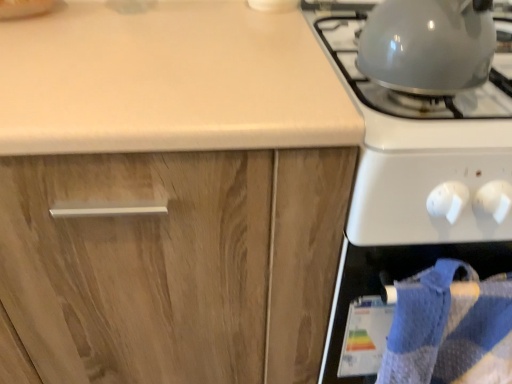
Question: Is blue textured towel at lower right placed right next to shiny metallic kettle at upper right, acting as the 2th gas stove starting from the right?

Choices:
 (A) no
 (B) yes

Answer: (A)

Question: Is blue textured towel at lower right surrounding shiny metallic kettle at upper right, which is the first gas stove in left-to-right order?

Choices:
 (A) yes
 (B) no

Answer: (B)

Question: Is blue textured towel at lower right wider than shiny metallic kettle at upper right, acting as the 2th gas stove starting from the right?

Choices:
 (A) yes
 (B) no

Answer: (B)

Question: From the image's perspective, is blue textured towel at lower right beneath shiny metallic kettle at upper right, which is the first gas stove in left-to-right order?

Choices:
 (A) yes
 (B) no

Answer: (A)

Question: Is blue textured towel at lower right bigger than shiny metallic kettle at upper right, acting as the 2th gas stove starting from the right?

Choices:
 (A) no
 (B) yes

Answer: (B)

Question: Is blue textured towel at lower right facing towards shiny metallic kettle at upper right, which is the first gas stove in left-to-right order?

Choices:
 (A) yes
 (B) no

Answer: (B)

Question: Does glossy white gas stove at right, which is the first gas stove from right to left, have a greater width compared to wooden cabinet at center?

Choices:
 (A) no
 (B) yes

Answer: (B)

Question: Considering the relative positions of glossy white gas stove at right, the 2th gas stove from the left, and wooden cabinet at center in the image provided, is glossy white gas stove at right, the 2th gas stove from the left, in front of wooden cabinet at center?

Choices:
 (A) no
 (B) yes

Answer: (B)

Question: Considering the relative positions of glossy white gas stove at right, the 2th gas stove from the left, and wooden cabinet at center in the image provided, is glossy white gas stove at right, the 2th gas stove from the left, to the right of wooden cabinet at center from the viewer's perspective?

Choices:
 (A) no
 (B) yes

Answer: (B)

Question: From the image's perspective, is glossy white gas stove at right, the 2th gas stove from the left, above wooden cabinet at center?

Choices:
 (A) yes
 (B) no

Answer: (A)

Question: Is glossy white gas stove at right, the 2th gas stove from the left, not near wooden cabinet at center?

Choices:
 (A) yes
 (B) no

Answer: (B)

Question: Is glossy white gas stove at right, the 2th gas stove from the left, at the left side of wooden cabinet at center?

Choices:
 (A) no
 (B) yes

Answer: (A)

Question: Can you confirm if glossy white gas stove at right, which is the first gas stove from right to left, is positioned to the right of shiny metallic kettle at upper right, which is the first gas stove in left-to-right order?

Choices:
 (A) yes
 (B) no

Answer: (A)